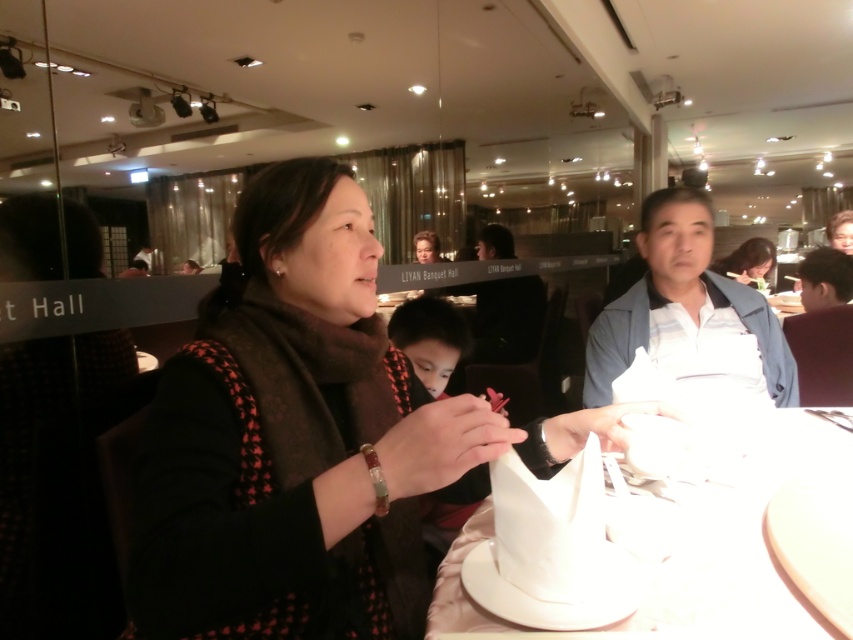
Who is more forward, (722, 508) or (846, 266)?

Positioned in front is point (722, 508).

Where is `white paper plate at center`? This screenshot has width=853, height=640. white paper plate at center is located at coordinates 744,547.

The image size is (853, 640). I want to click on matte brown scarf at center, so click(294, 440).

Which is in front, point (334, 584) or point (625, 630)?

Point (625, 630) is more forward.

Describe the element at coordinates (294, 440) in the screenshot. I see `matte brown scarf at center` at that location.

This screenshot has height=640, width=853. Find the location of `matte brown scarf at center`. matte brown scarf at center is located at coordinates (294, 440).

Does brown hair at upper right have a larger size compared to matte black hair at upper right?

Result: Actually, brown hair at upper right might be smaller than matte black hair at upper right.

Does brown hair at upper right appear on the left side of matte black hair at upper right?

Indeed, brown hair at upper right is positioned on the left side of matte black hair at upper right.

The height and width of the screenshot is (640, 853). Find the location of `brown hair at upper right`. brown hair at upper right is located at coordinates (825, 278).